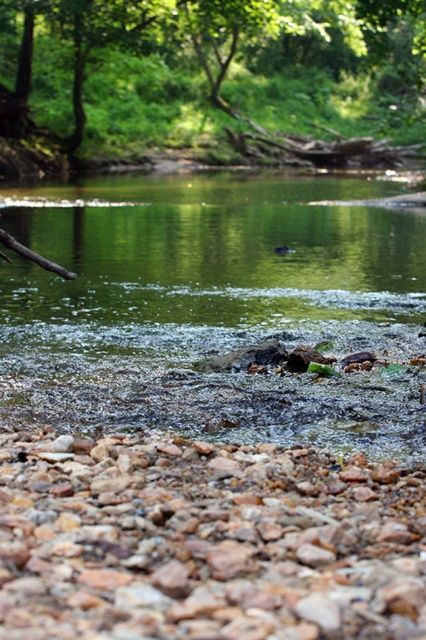
You are standing on the riverbank and want to place a small potted plant between the green mossy rock at center and the rusty gravel rocks at lower center. Can you place it directly between them without moving either rock?

Answer: The green mossy rock at center is positioned over the rusty gravel rocks at lower center, so there is no space between them to place the potted plant. You would need to move one of the rocks to make room.

You are standing on the rocky riverbank and want to reach the green leafy tree at upper center. Which direction should you move relative to the green mossy rock at center?

You should move to the left of the green mossy rock at center to reach the green leafy tree at upper center because the tree is to the left of the rock according to the description.

Based on the photo, you are standing on the riverbank and see the rusty gravel rocks at lower center and the green leafy tree at upper center. Which object takes up more area in the scene?

The green leafy tree at upper center occupies more space than the rusty gravel rocks at lower center.